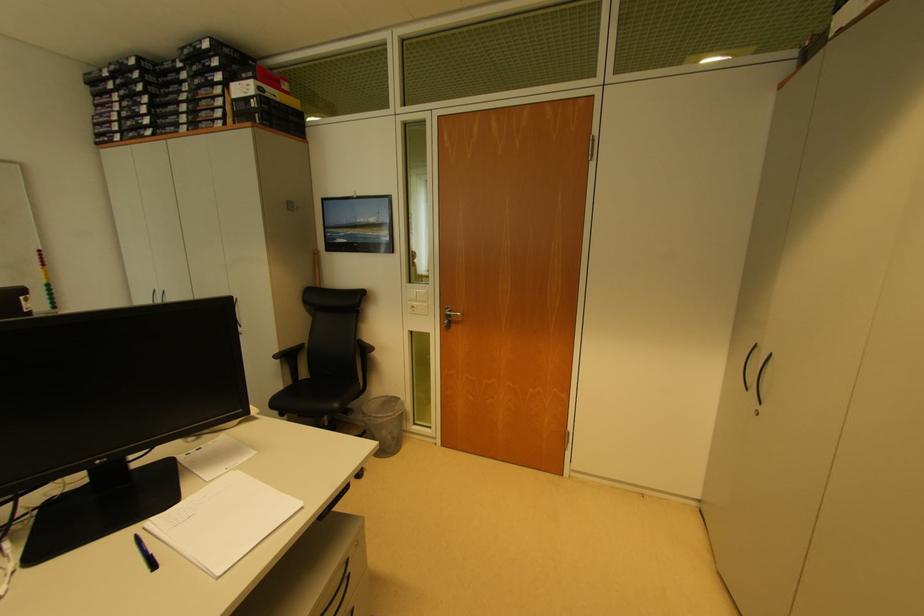
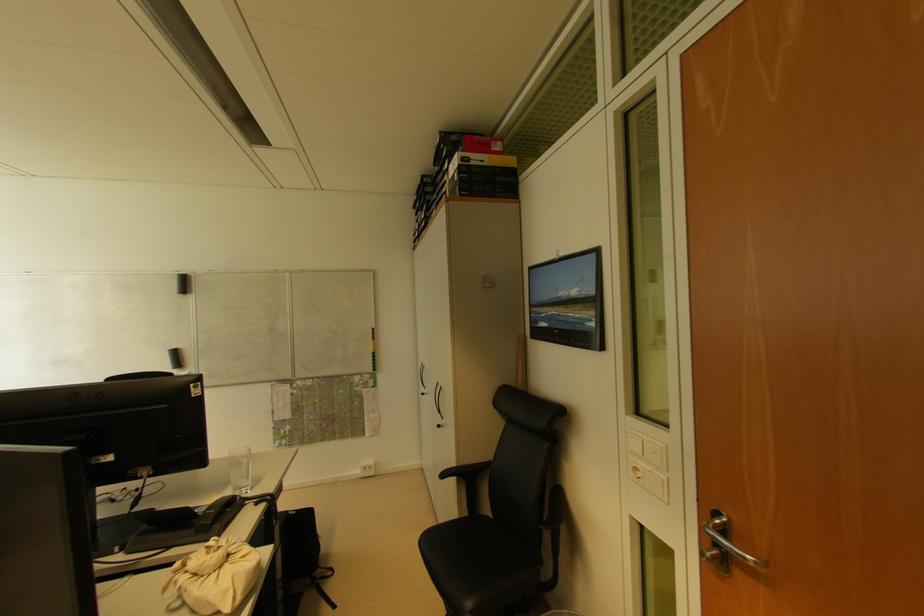
Locate, in the second image, the point that corresponds to (415,310) in the first image.

(638, 471)